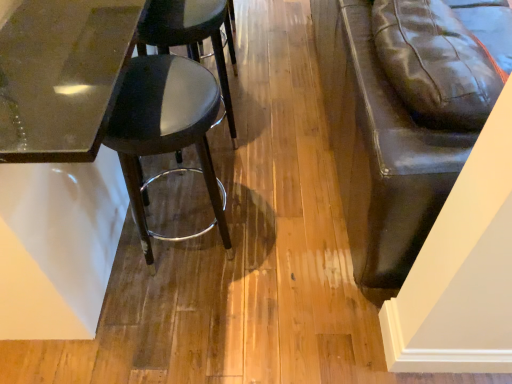
Question: Could black leather stool at center, the second stool from the bottom, be considered to be inside glossy glass table at upper left?

Choices:
 (A) no
 (B) yes

Answer: (B)

Question: Is glossy glass table at upper left completely or partially outside of black leather stool at center, the second stool from the bottom?

Choices:
 (A) no
 (B) yes

Answer: (B)

Question: Is glossy glass table at upper left far from black leather stool at center, the second stool from the bottom?

Choices:
 (A) no
 (B) yes

Answer: (A)

Question: Considering the relative sizes of glossy glass table at upper left and black leather stool at center, positioned as the 1th stool in top-to-bottom order, in the image provided, is glossy glass table at upper left thinner than black leather stool at center, positioned as the 1th stool in top-to-bottom order,?

Choices:
 (A) no
 (B) yes

Answer: (A)

Question: Is glossy glass table at upper left positioned behind black leather stool at center, positioned as the 1th stool in top-to-bottom order?

Choices:
 (A) yes
 (B) no

Answer: (B)

Question: From the image's perspective, is glossy glass table at upper left over black leather stool at center, the second stool from the bottom?

Choices:
 (A) yes
 (B) no

Answer: (A)

Question: Does black leather stool at center, positioned as the 1th stool in top-to-bottom order, have a greater height compared to matte black stool at left, the 2th stool from the top?

Choices:
 (A) yes
 (B) no

Answer: (A)

Question: Is black leather stool at center, the second stool from the bottom, bigger than matte black stool at left, which is the first stool from bottom to top?

Choices:
 (A) no
 (B) yes

Answer: (B)

Question: From the image's perspective, is black leather stool at center, the second stool from the bottom, located above matte black stool at left, the 2th stool from the top?

Choices:
 (A) no
 (B) yes

Answer: (B)

Question: Considering the relative sizes of black leather stool at center, the second stool from the bottom, and matte black stool at left, the 2th stool from the top, in the image provided, is black leather stool at center, the second stool from the bottom, wider than matte black stool at left, the 2th stool from the top,?

Choices:
 (A) yes
 (B) no

Answer: (B)

Question: Is the surface of black leather stool at center, the second stool from the bottom, in direct contact with matte black stool at left, the 2th stool from the top?

Choices:
 (A) no
 (B) yes

Answer: (A)

Question: Is black leather stool at center, the second stool from the bottom, not close to matte black stool at left, which is the first stool from bottom to top?

Choices:
 (A) yes
 (B) no

Answer: (B)

Question: Could matte black stool at left, which is the first stool from bottom to top, be considered to be inside glossy glass table at upper left?

Choices:
 (A) yes
 (B) no

Answer: (A)